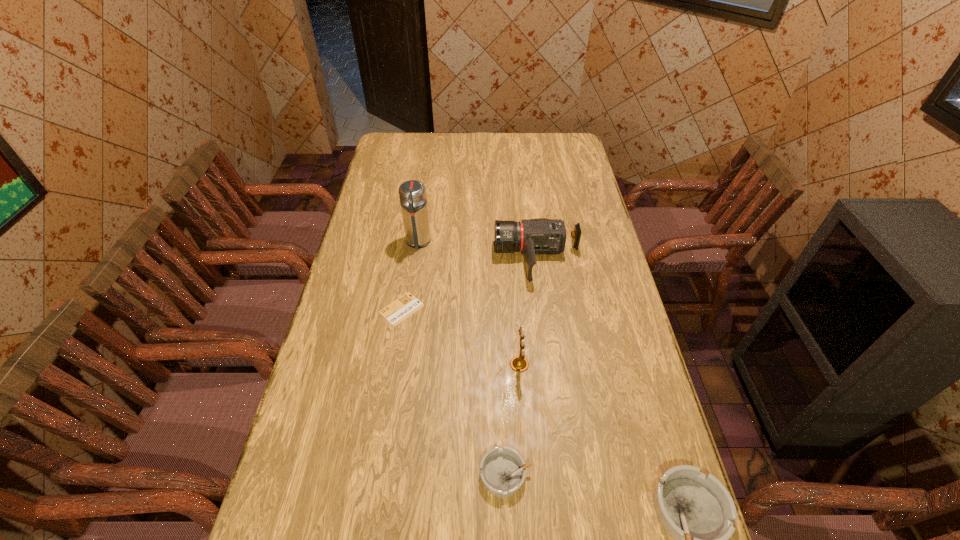
Locate an element on the screen. This screenshot has width=960, height=540. free space located 0.060m on the lens of the camcorder is located at coordinates click(x=478, y=259).

The image size is (960, 540). In order to click on vacant region located on the lens of the camcorder in this screenshot , I will do coord(475,259).

The image size is (960, 540). I want to click on blank area located 0.180m on the right of the shortest object, so click(x=480, y=309).

I want to click on vacant area located 0.060m with a handle on the side of the tallest object, so click(x=415, y=265).

Find the location of `vacant space located 0.210m on the right of the candelabrum`. vacant space located 0.210m on the right of the candelabrum is located at coordinates (603, 364).

You are a GUI agent. You are given a task and a screenshot of the screen. Output one action in this format:
    pyautogui.click(x=<x>, y=<y>)
    Task: Click on the object situated at the near edge
    Image resolution: width=960 pixels, height=540 pixels.
    Given the screenshot: What is the action you would take?
    pyautogui.click(x=503, y=471)

Where is `object located in the left edge section of the desktop`? object located in the left edge section of the desktop is located at coordinates (396, 312).

You are a GUI agent. You are given a task and a screenshot of the screen. Output one action in this format:
    pyautogui.click(x=<x>, y=<y>)
    Task: Click on the object positioned at the right edge
    
    Given the screenshot: What is the action you would take?
    pyautogui.click(x=540, y=235)

Find the location of `free space at the far edge of the desktop`. free space at the far edge of the desktop is located at coordinates (417, 148).

This screenshot has width=960, height=540. In the image, there is a desktop. Find the location of `free space at the left edge`. free space at the left edge is located at coordinates (306, 414).